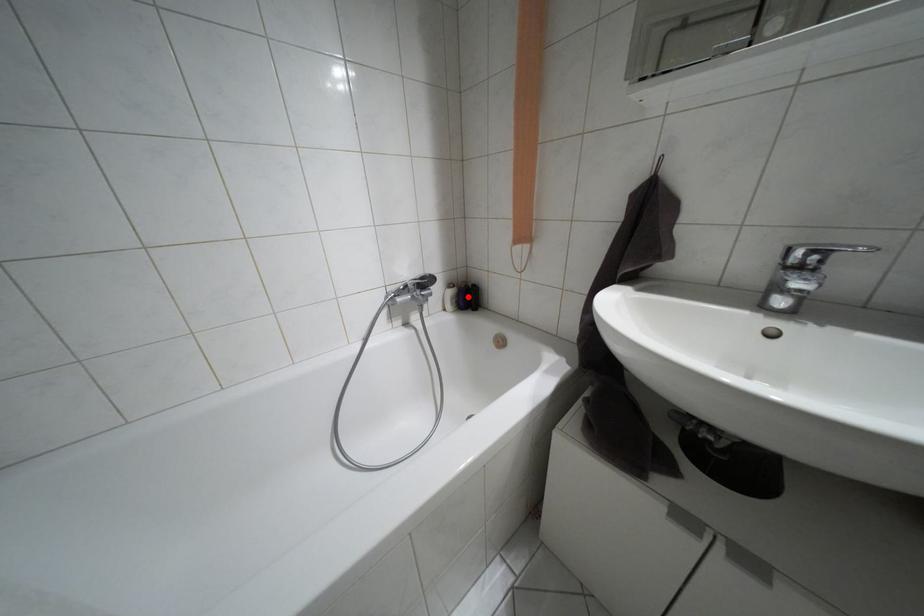
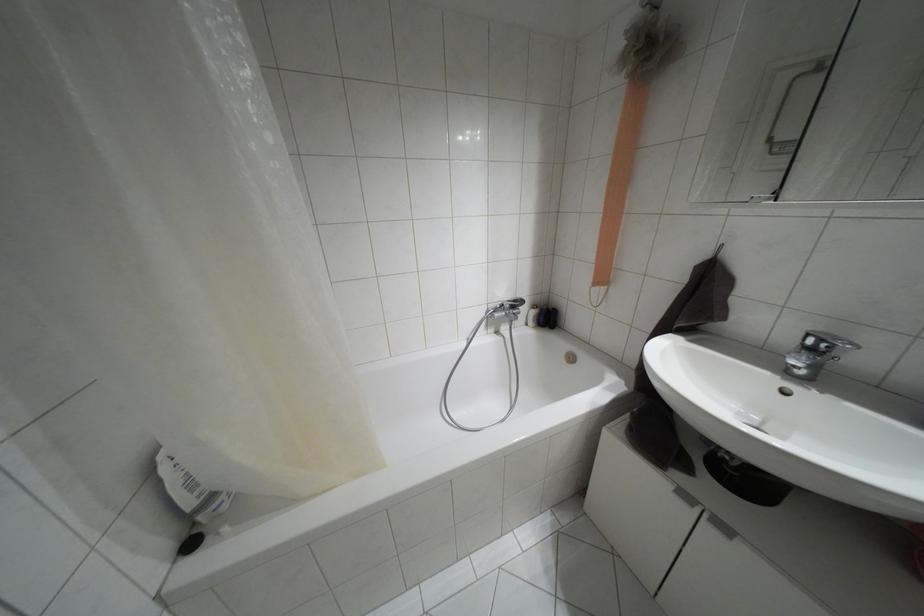
In the second image, find the point that corresponds to the highlighted location in the first image.

(546, 317)